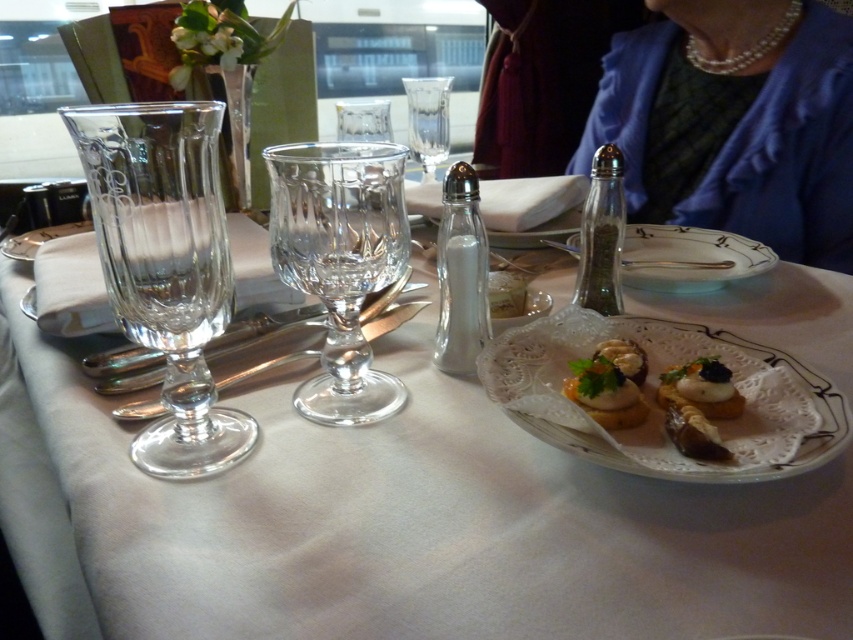
Can you confirm if pearl necklace at upper center is shorter than white glass salt shaker at center?

No.

Who is shorter, pearl necklace at upper center or white glass salt shaker at center?

white glass salt shaker at center

Between point (817, 256) and point (480, 244), which one is positioned in front?

Point (480, 244)

At what (x,y) coordinates should I click in order to perform the action: click on pearl necklace at upper center. Please return your answer as a coordinate pair (x, y). The height and width of the screenshot is (640, 853). Looking at the image, I should click on click(735, 122).

Can you confirm if white lace plate at center is positioned below white creamy sauce at center?

Actually, white lace plate at center is above white creamy sauce at center.

Between point (734, 250) and point (718, 400), which one is positioned behind?

Point (734, 250)

Is point (688, 288) behind point (694, 380)?

Yes, it is behind point (694, 380).

Identify the location of white lace plate at center. The height and width of the screenshot is (640, 853). (688, 259).

Is point (693, 164) positioned before point (624, 340)?

No, (693, 164) is behind (624, 340).

Which is behind, point (717, 28) or point (630, 365)?

The point (717, 28) is behind.

Between point (643, 120) and point (640, 380), which one is positioned in front?

Point (640, 380) is more forward.

Find the location of a particular element. Image resolution: width=853 pixels, height=640 pixels. pearl necklace at upper center is located at coordinates (735, 122).